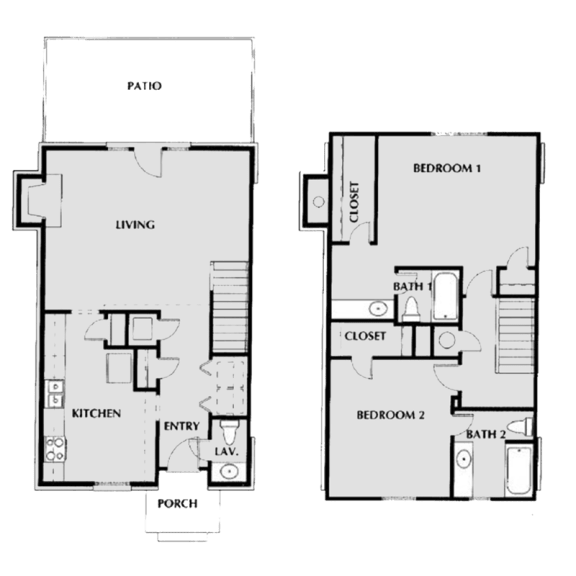
You are a GUI agent. You are given a task and a screenshot of the screen. Output one action in this format:
    pyautogui.click(x=<x>, y=<y>)
    Task: Click on the kitchen sink
    
    Given the screenshot: What is the action you would take?
    pyautogui.click(x=54, y=395)